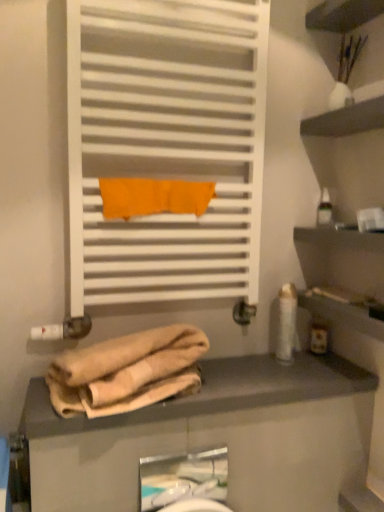
Find the location of a particular element. This screenshot has width=384, height=512. vacant space situated above beige fabric at lower center (from a real-world perspective) is located at coordinates (249, 375).